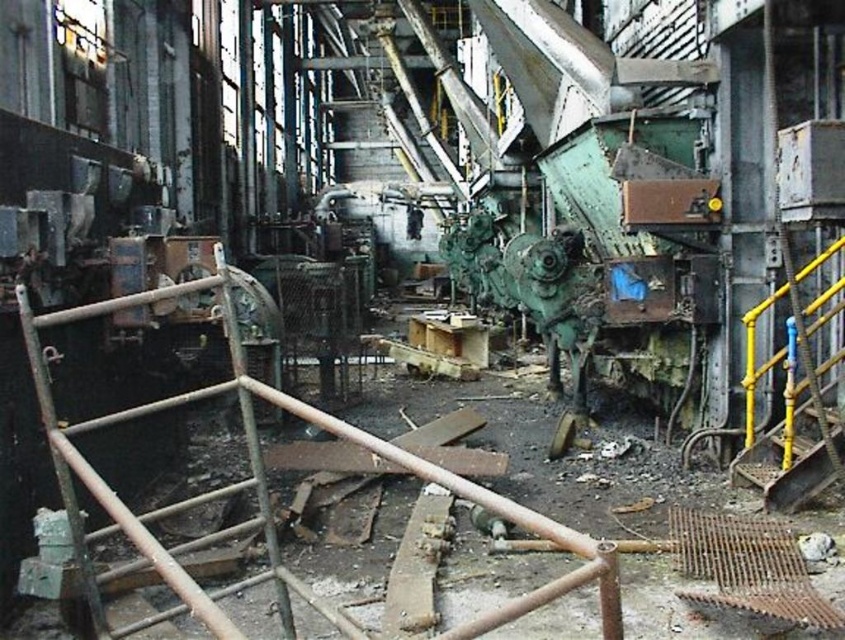
You are a maintenance worker needing to reach a high platform. You see a rusty metal ladder at left and a yellow metal ladder at right. Which ladder is closer to your current position?

The rusty metal ladder at left is closer to your current position since it is only 3.72 meters away from the yellow metal ladder at right, but without knowing your exact location, we can only state their distance apart.

You are a maintenance worker in the factory and need to reach both the point at coordinates point (126, 420) and point (772, 305). Which point should you go to first if you want to reach the closer one first?

You should go to point (126, 420) first because it is closer to you than point (772, 305).

You are a maintenance worker needing to access a high platform in this industrial setting. You see a rusty metal ladder at left and a yellow metal ladder at right. Which ladder is positioned lower and thus more accessible from the ground?

The rusty metal ladder at left is positioned lower than the yellow metal ladder at right, making it more accessible from the ground.